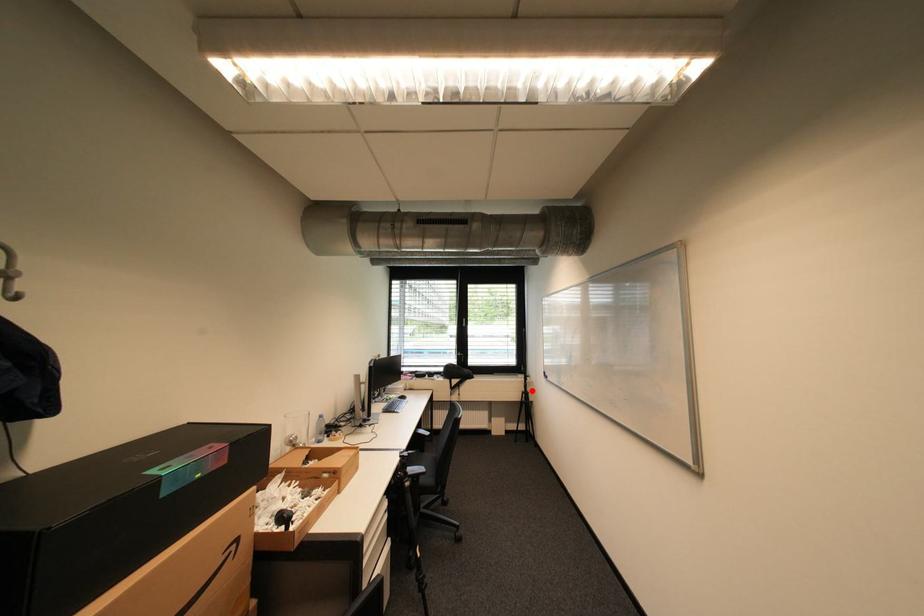
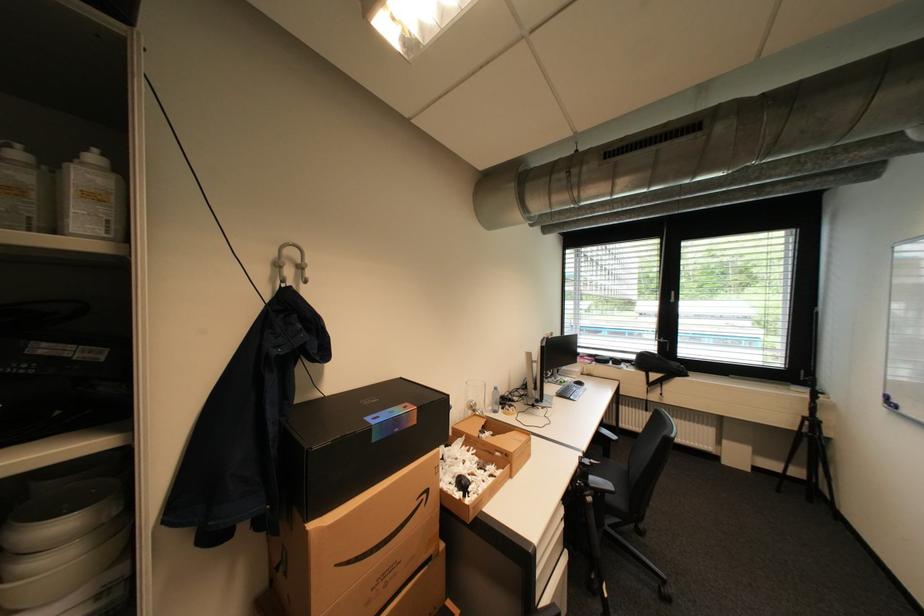
The point at the highlighted location is marked in the first image. Where is the corresponding point in the second image?

(815, 415)